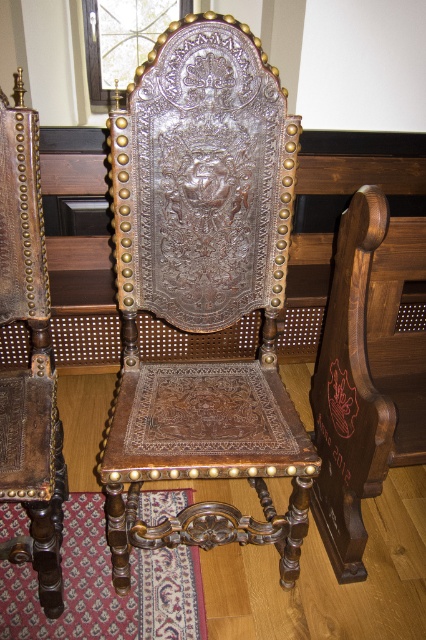
Question: Can you confirm if polished wood armchair at center is positioned above leather at left?

Choices:
 (A) yes
 (B) no

Answer: (A)

Question: Which point is farther from the camera taking this photo?

Choices:
 (A) (184, 323)
 (B) (16, 262)

Answer: (A)

Question: Which point is closer to the camera taking this photo?

Choices:
 (A) (158, 132)
 (B) (48, 365)

Answer: (A)

Question: Where is polished wood armchair at center located in relation to leather at left in the image?

Choices:
 (A) left
 (B) right

Answer: (B)

Question: Does polished wood armchair at center have a lesser width compared to leather at left?

Choices:
 (A) yes
 (B) no

Answer: (B)